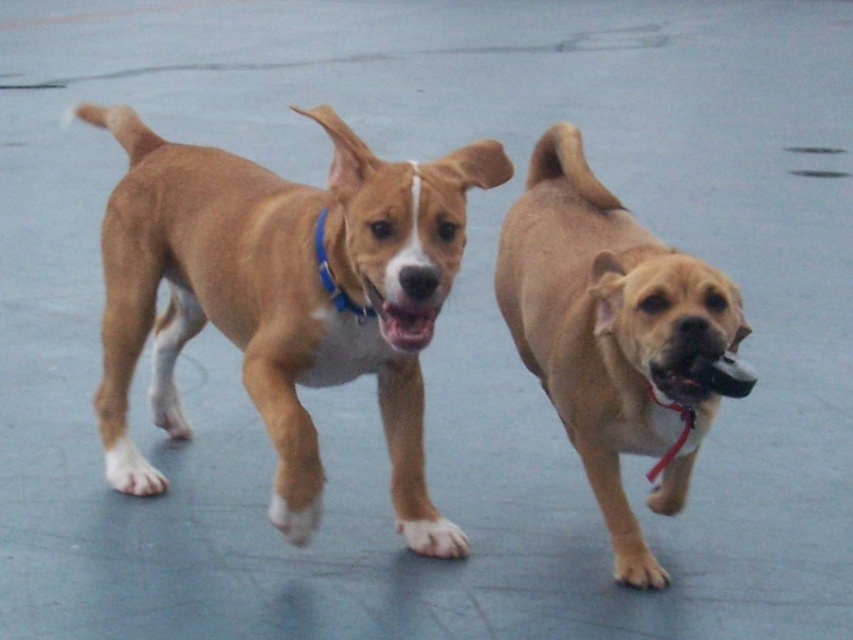
You are a dog trainer observing two dogs running side by side on a paved surface. You notice the brown matte dog at center and the light brown fur at center. Which dog has a greater height?

The brown matte dog at center is taller than the light brown fur at center.

Looking at this image, you are a dog owner trying to identify your pets in a photo. You have two dogs, a brown matte dog at center and a blue fabric neckband at center. Based on their positions, which dog is on the left side?

The brown matte dog at center is positioned on the left side of the blue fabric neckband at center, so the brown matte dog at center is on the left.